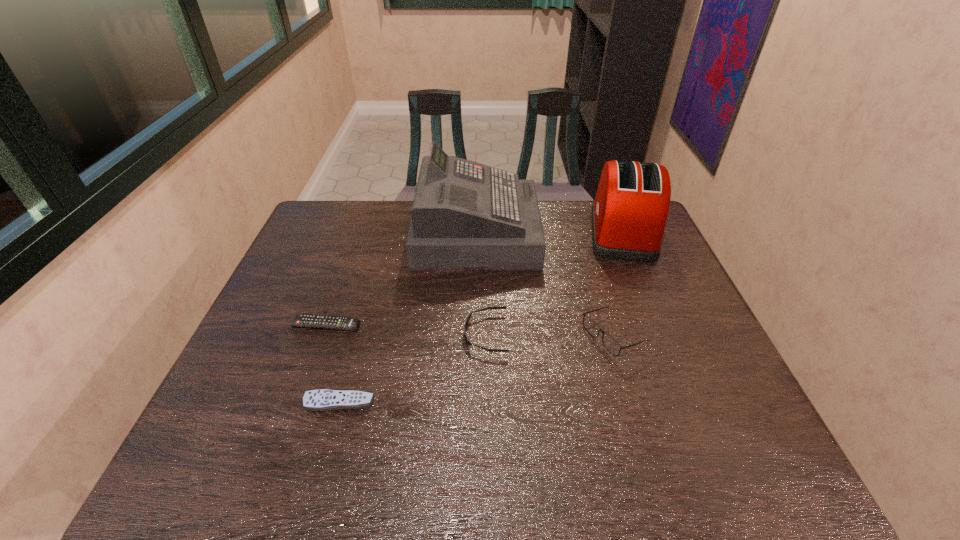
Identify the location of vacant point located between the toaster and the cash register. Image resolution: width=960 pixels, height=540 pixels. (549, 233).

What are the coordinates of `vacant space that is in between the sunglasses and the cash register` in the screenshot? It's located at (481, 284).

You are a GUI agent. You are given a task and a screenshot of the screen. Output one action in this format:
    pyautogui.click(x=<x>, y=<y>)
    Task: Click on the empty location between the spectacles and the nearest object
    
    Given the screenshot: What is the action you would take?
    pyautogui.click(x=476, y=369)

Identify the location of free space between the third shortest object and the cash register. This screenshot has width=960, height=540. (481, 284).

Identify the location of vacant point located between the farther remote control and the spectacles. (469, 330).

The width and height of the screenshot is (960, 540). I want to click on object that is the nearest to the fourth tallest object, so click(465, 215).

The height and width of the screenshot is (540, 960). What are the coordinates of `object identified as the fifth closest to the third shortest object` in the screenshot? It's located at (629, 213).

This screenshot has width=960, height=540. I want to click on vacant area that satisfies the following two spatial constraints: 1. on the front side of the toaster; 2. with the lenses facing outward on the fourth shortest object, so click(x=665, y=336).

The height and width of the screenshot is (540, 960). Identify the location of free region that satisfies the following two spatial constraints: 1. on the back side of the farther remote control; 2. on the left side of the toaster. (359, 232).